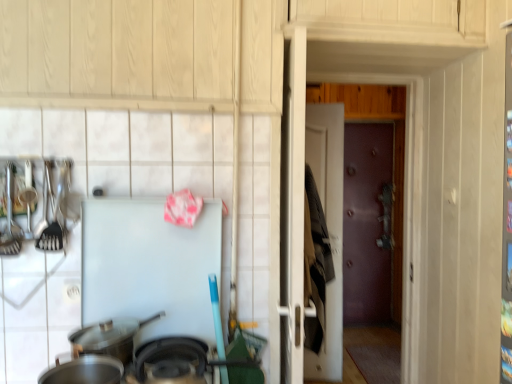
You are a GUI agent. You are given a task and a screenshot of the screen. Output one action in this format:
    pyautogui.click(x=<x>, y=<y>)
    Task: Click on the vacant space situated above purple matte door at center (from a real-world perspective)
    The height and width of the screenshot is (384, 512).
    Given the screenshot: What is the action you would take?
    pyautogui.click(x=352, y=79)